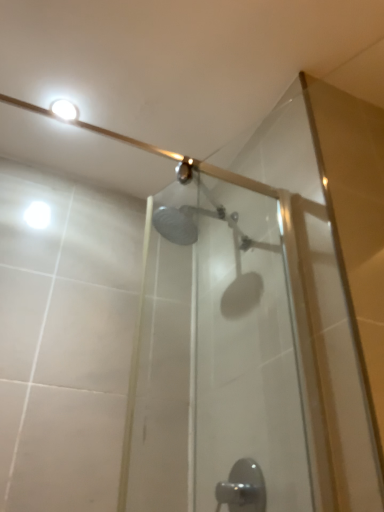
Question: In the image, is white glossy light fixture at upper left on the left side or the right side of satin nickel faucet at lower center?

Choices:
 (A) right
 (B) left

Answer: (B)

Question: In terms of height, does white glossy light fixture at upper left look taller or shorter compared to satin nickel faucet at lower center?

Choices:
 (A) short
 (B) tall

Answer: (A)

Question: From a real-world perspective, is white glossy light fixture at upper left positioned above or below satin nickel faucet at lower center?

Choices:
 (A) above
 (B) below

Answer: (A)

Question: In terms of height, does satin nickel faucet at lower center look taller or shorter compared to white glossy light fixture at upper left?

Choices:
 (A) short
 (B) tall

Answer: (B)

Question: Looking at the image, does satin nickel faucet at lower center seem bigger or smaller compared to white glossy light fixture at upper left?

Choices:
 (A) small
 (B) big

Answer: (B)

Question: From a real-world perspective, is satin nickel faucet at lower center above or below white glossy light fixture at upper left?

Choices:
 (A) below
 (B) above

Answer: (A)

Question: Is point (256, 492) closer or farther from the camera than point (72, 116)?

Choices:
 (A) farther
 (B) closer

Answer: (B)